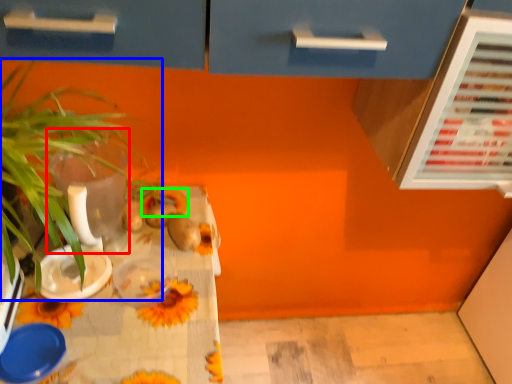
Question: Considering the real-world distances, which object is farthest from glass vase (highlighted by a red box)? houseplant (highlighted by a blue box) or flower (highlighted by a green box)?

Choices:
 (A) houseplant
 (B) flower

Answer: (B)